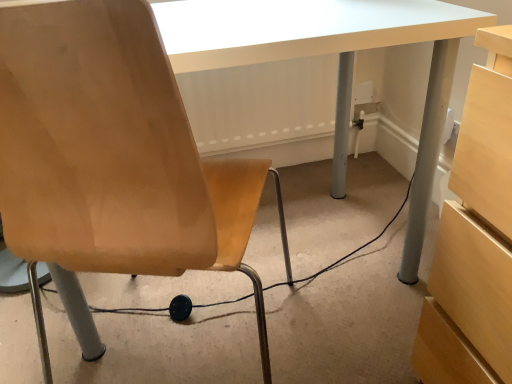
Question: Considering the relative sizes of matte wood chair at left and black rubber cable at lower center in the image provided, is matte wood chair at left wider than black rubber cable at lower center?

Choices:
 (A) yes
 (B) no

Answer: (B)

Question: Is matte wood chair at left taller than black rubber cable at lower center?

Choices:
 (A) yes
 (B) no

Answer: (A)

Question: Is matte wood chair at left looking in the opposite direction of black rubber cable at lower center?

Choices:
 (A) no
 (B) yes

Answer: (A)

Question: Is matte wood chair at left next to black rubber cable at lower center?

Choices:
 (A) yes
 (B) no

Answer: (B)

Question: Does matte wood chair at left have a lesser width compared to black rubber cable at lower center?

Choices:
 (A) no
 (B) yes

Answer: (B)

Question: Is matte wood chair at left to the right of black rubber cable at lower center from the viewer's perspective?

Choices:
 (A) yes
 (B) no

Answer: (B)

Question: Is black rubber cable at lower center not close to matte wood chair at left?

Choices:
 (A) no
 (B) yes

Answer: (A)

Question: Considering the relative sizes of black rubber cable at lower center and matte wood chair at left in the image provided, is black rubber cable at lower center taller than matte wood chair at left?

Choices:
 (A) no
 (B) yes

Answer: (A)

Question: Is matte wood chair at left at the back of black rubber cable at lower center?

Choices:
 (A) yes
 (B) no

Answer: (B)

Question: Considering the relative positions of black rubber cable at lower center and matte wood chair at left in the image provided, is black rubber cable at lower center behind matte wood chair at left?

Choices:
 (A) yes
 (B) no

Answer: (A)

Question: Can you confirm if black rubber cable at lower center is wider than matte wood chair at left?

Choices:
 (A) yes
 (B) no

Answer: (A)

Question: Can you confirm if black rubber cable at lower center is shorter than matte wood chair at left?

Choices:
 (A) yes
 (B) no

Answer: (A)

Question: Based on their positions, is black rubber cable at lower center located to the left or right of matte wood chair at left?

Choices:
 (A) right
 (B) left

Answer: (A)